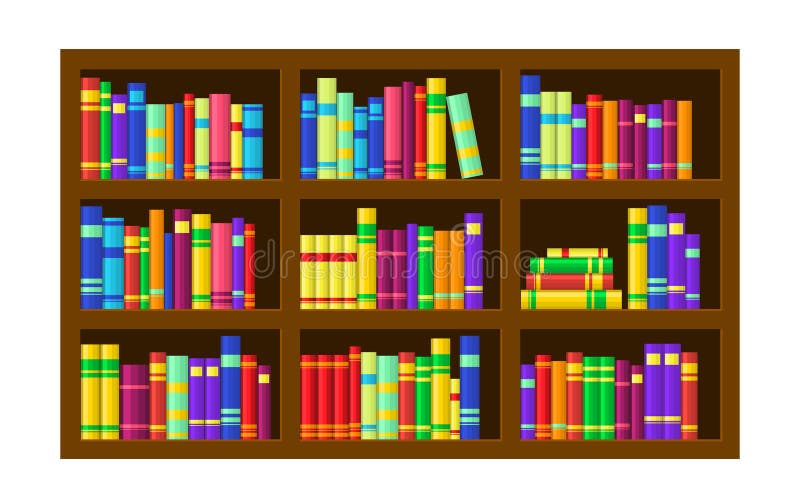
The width and height of the screenshot is (800, 500). Identify the location of books on the top middle shelf. (309, 146), (326, 140), (344, 139), (362, 139), (374, 136), (390, 135), (405, 137), (417, 136), (436, 134), (461, 134).